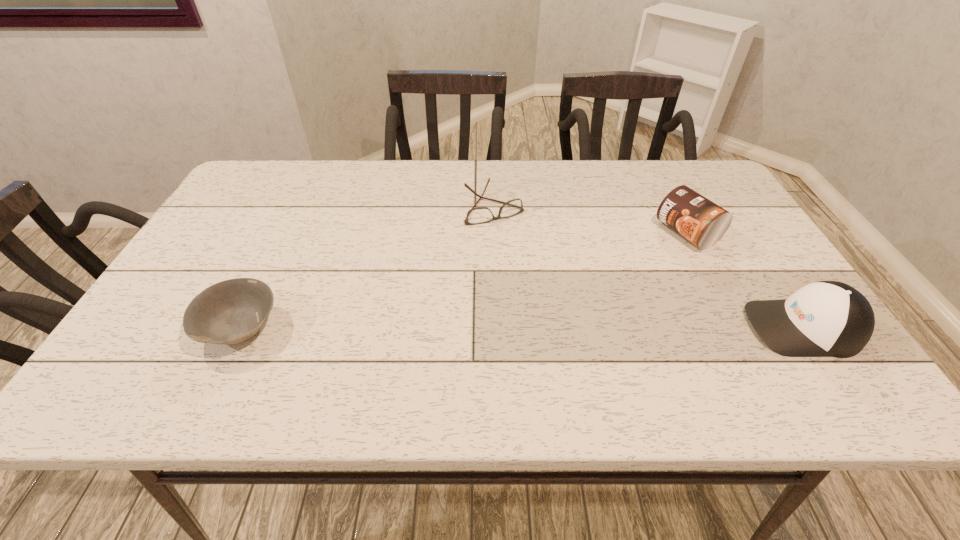
The height and width of the screenshot is (540, 960). What are the coordinates of `cap that is at the right edge` in the screenshot? It's located at (826, 318).

What are the coordinates of `can present at the right edge` in the screenshot? It's located at (702, 222).

The width and height of the screenshot is (960, 540). In order to click on object that is at the near left corner in this screenshot , I will do `click(229, 312)`.

Locate an element on the screen. This screenshot has height=540, width=960. object present at the near right corner is located at coordinates (826, 318).

The width and height of the screenshot is (960, 540). I want to click on blank space at the far edge of the desktop, so click(x=418, y=171).

Where is `free space at the near edge`? free space at the near edge is located at coordinates (273, 353).

This screenshot has width=960, height=540. In the image, there is a desktop. Find the location of `blank space at the left edge`. blank space at the left edge is located at coordinates (174, 305).

I want to click on free space at the right edge of the desktop, so click(x=722, y=286).

In order to click on free space at the far left corner of the desktop in this screenshot , I will do `click(258, 193)`.

This screenshot has height=540, width=960. What are the coordinates of `vacant region at the far right corner` in the screenshot? It's located at (668, 168).